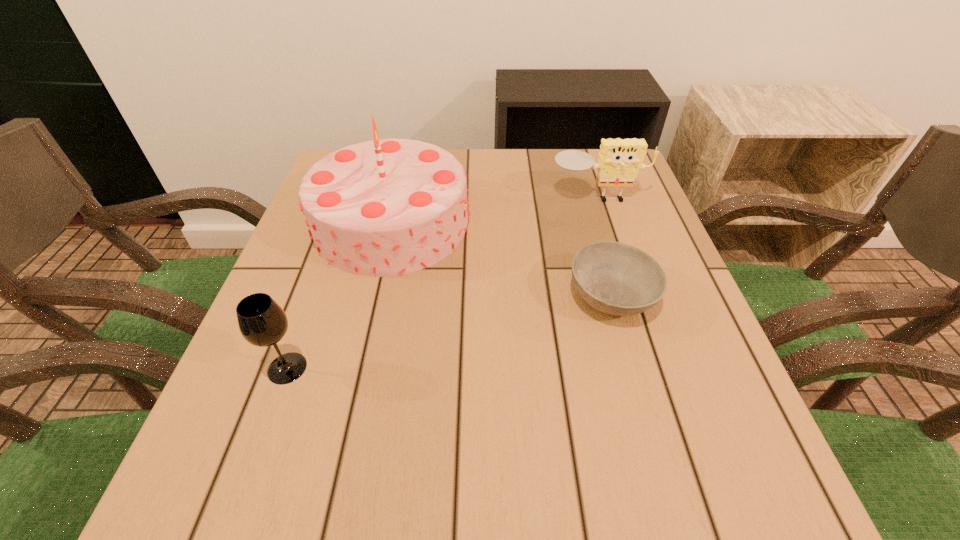
The height and width of the screenshot is (540, 960). In order to click on birthday cake in this screenshot , I will do `click(385, 207)`.

The width and height of the screenshot is (960, 540). I want to click on the nearest object, so click(262, 322).

Find the location of a particular element. The width and height of the screenshot is (960, 540). sponge is located at coordinates (619, 161).

Where is `bowl`? bowl is located at coordinates (615, 278).

Where is `vacant space located on the front of the tallest object`? vacant space located on the front of the tallest object is located at coordinates (369, 321).

At what (x,y) coordinates should I click in order to perform the action: click on vacant region located 0.260m on the back of the wineglass. Please return your answer as a coordinate pair (x, y). Looking at the image, I should click on (329, 251).

This screenshot has width=960, height=540. What are the coordinates of `vacant region located 0.320m on the front-facing side of the sponge` in the screenshot? It's located at (635, 310).

The width and height of the screenshot is (960, 540). In order to click on free region located on the front of the shortest object in this screenshot , I will do `click(669, 498)`.

You are a GUI agent. You are given a task and a screenshot of the screen. Output one action in this format:
    pyautogui.click(x=<x>, y=<y>)
    Task: Click on the birthday cake situated at the far edge
    The height and width of the screenshot is (540, 960).
    Given the screenshot: What is the action you would take?
    pyautogui.click(x=385, y=207)

In order to click on sponge positioned at the far edge in this screenshot , I will do `click(619, 161)`.